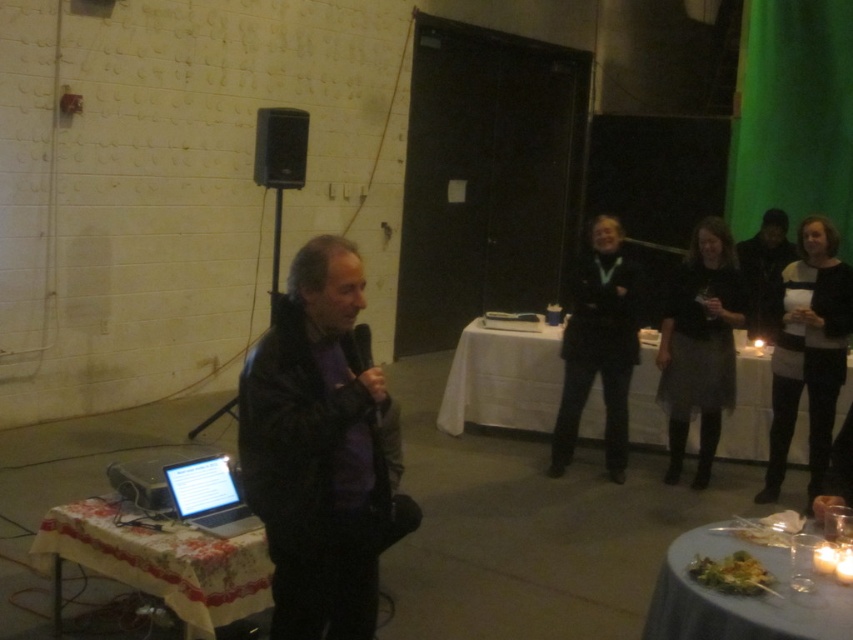
Based on the photo, you are a stagehand who needs to move a 10 foot long extension cord from the white lace tablecloth at lower left to the dark gray skirt at right. Can you safely lay the cord without it being too short?

The white lace tablecloth at lower left is 10.31 feet away from the dark gray skirt at right. Since the extension cord is 10 feet long, it is slightly shorter than the distance required. You may need a slightly longer cord to ensure a safe connection.

You are standing in the middle of the room and want to walk to the white lace tablecloth at lower left. Which direction should you move in?

Since the white lace tablecloth at lower left is located at point (x=161, y=561), you should move towards the lower left direction to reach it.

You are organizing an event and need to place a decorative centerpiece on the table. The white glossy plate at lower right and the silver metallic laptop at lower left are already on the table. Which object can accommodate a larger centerpiece?

The white glossy plate at lower right can accommodate a larger centerpiece since it has a larger size compared to the silver metallic laptop at lower left.